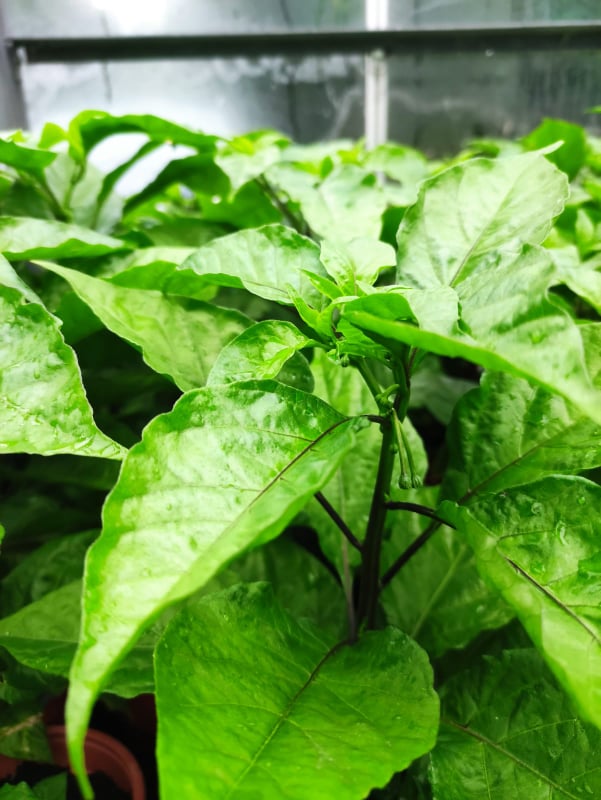
What are the coordinates of `light` in the screenshot? It's located at (141, 10).